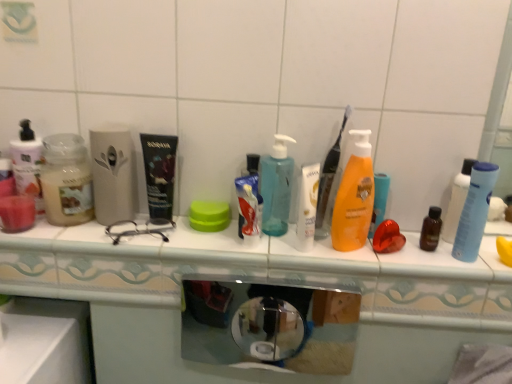
Question: Does white glossy toothpaste at center have a lesser width compared to orange matte lotion at center, the 1th bottle when ordered from right to left?

Choices:
 (A) no
 (B) yes

Answer: (B)

Question: Does white glossy toothpaste at center contain orange matte lotion at center, marked as the third bottle in a left-to-right arrangement?

Choices:
 (A) no
 (B) yes

Answer: (A)

Question: Is white glossy toothpaste at center facing towards orange matte lotion at center, marked as the third bottle in a left-to-right arrangement?

Choices:
 (A) yes
 (B) no

Answer: (B)

Question: From the image's perspective, is white glossy toothpaste at center located beneath orange matte lotion at center, marked as the third bottle in a left-to-right arrangement?

Choices:
 (A) no
 (B) yes

Answer: (B)

Question: Is white glossy toothpaste at center far away from orange matte lotion at center, marked as the third bottle in a left-to-right arrangement?

Choices:
 (A) yes
 (B) no

Answer: (B)

Question: Does white glossy toothpaste at center have a larger size compared to orange matte lotion at center, marked as the third bottle in a left-to-right arrangement?

Choices:
 (A) no
 (B) yes

Answer: (A)

Question: Is orange matte lotion at center, the 1th bottle when ordered from right to left, positioned in front of blue matte bottle at right?

Choices:
 (A) no
 (B) yes

Answer: (B)

Question: Is blue matte bottle at right located within orange matte lotion at center, marked as the third bottle in a left-to-right arrangement?

Choices:
 (A) yes
 (B) no

Answer: (B)

Question: Is there a large distance between orange matte lotion at center, the 1th bottle when ordered from right to left, and blue matte bottle at right?

Choices:
 (A) yes
 (B) no

Answer: (B)

Question: Does orange matte lotion at center, the 1th bottle when ordered from right to left, have a smaller size compared to blue matte bottle at right?

Choices:
 (A) yes
 (B) no

Answer: (B)

Question: Is orange matte lotion at center, marked as the third bottle in a left-to-right arrangement, to the right of blue matte bottle at right from the viewer's perspective?

Choices:
 (A) yes
 (B) no

Answer: (B)

Question: From the image's perspective, is orange matte lotion at center, the 1th bottle when ordered from right to left, on blue matte bottle at right?

Choices:
 (A) no
 (B) yes

Answer: (B)

Question: From the image's perspective, is translucent plastic pump bottle at center, the 2th bottle viewed from the left, under green plastic lid at center?

Choices:
 (A) yes
 (B) no

Answer: (B)